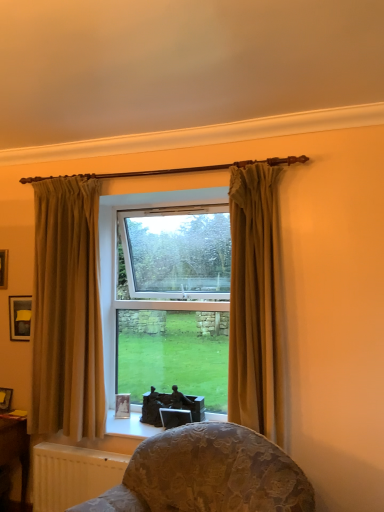
What do you see at coordinates (15, 448) in the screenshot?
I see `wooden table at lower left` at bounding box center [15, 448].

Identify the location of matte silver picture frame at lower center, which is counted as the 4th picture frame, starting from the left. The height and width of the screenshot is (512, 384). (122, 406).

How much space does matte black picture frame at upper left, placed as the third picture frame when sorted from bottom to top, occupy horizontally?

It is 1.46 inches.

Where is `matte beige curtain at left, placed as the 2th curtain when sorted from front to back`? This screenshot has width=384, height=512. matte beige curtain at left, placed as the 2th curtain when sorted from front to back is located at coordinates (67, 311).

You are a GUI agent. You are given a task and a screenshot of the screen. Output one action in this format:
    pyautogui.click(x=<x>, y=<y>)
    Task: Click on the matte glass window at center
    
    Given the screenshot: What is the action you would take?
    pyautogui.click(x=174, y=302)

Which of these two, velvet-patterned armchair at lower center or matte black picture frame at upper left, the third picture frame in the left-to-right sequence, stands taller?

Standing taller between the two is velvet-patterned armchair at lower center.

From a real-world perspective, is velvet-patterned armchair at lower center on top of matte black picture frame at upper left, the third picture frame in the left-to-right sequence?

No, from a real-world perspective, velvet-patterned armchair at lower center is not over matte black picture frame at upper left, the third picture frame in the left-to-right sequence

Is velvet-patterned armchair at lower center positioned behind matte black picture frame at upper left, the third picture frame in the left-to-right sequence?

That is False.

Based on the photo, considering the positions of objects velvet-patterned armchair at lower center and matte black picture frame at upper left, the 2th picture frame when ordered from top to bottom, in the image provided, who is more to the right, velvet-patterned armchair at lower center or matte black picture frame at upper left, the 2th picture frame when ordered from top to bottom,?

velvet-patterned armchair at lower center.

Based on the photo, can you confirm if matte gold curtain at center, which is the 1th curtain in front-to-back order, is taller than velvet-patterned armchair at lower center?

Correct, matte gold curtain at center, which is the 1th curtain in front-to-back order, is much taller as velvet-patterned armchair at lower center.

Can you see matte gold curtain at center, which is the 1th curtain in front-to-back order, touching velvet-patterned armchair at lower center?

There is a gap between matte gold curtain at center, which is the 1th curtain in front-to-back order, and velvet-patterned armchair at lower center.

Which object is thinner, matte gold curtain at center, which is the 1th curtain in front-to-back order, or velvet-patterned armchair at lower center?

Thinner between the two is matte gold curtain at center, which is the 1th curtain in front-to-back order.

What's the angular difference between matte gold curtain at center, which is the 1th curtain from right to left, and velvet-patterned armchair at lower center's facing directions?

The angular difference between matte gold curtain at center, which is the 1th curtain from right to left, and velvet-patterned armchair at lower center is 23.5 degrees.

Considering the sizes of objects velvet-patterned armchair at lower center and matte gold curtain at center, which is the 1th curtain from right to left, in the image provided, who is smaller, velvet-patterned armchair at lower center or matte gold curtain at center, which is the 1th curtain from right to left,?

Smaller between the two is matte gold curtain at center, which is the 1th curtain from right to left.

Considering their positions, is velvet-patterned armchair at lower center located in front of or behind matte gold curtain at center, which ranks as the 2th curtain in back-to-front order?

Visually, velvet-patterned armchair at lower center is located in front of matte gold curtain at center, which ranks as the 2th curtain in back-to-front order.

From a real-world perspective, is velvet-patterned armchair at lower center below matte gold curtain at center, which ranks as the 2th curtain in back-to-front order?

Yes, from a real-world perspective, velvet-patterned armchair at lower center is under matte gold curtain at center, which ranks as the 2th curtain in back-to-front order.

In terms of width, does velvet-patterned armchair at lower center look wider or thinner when compared to matte gold curtain at center, which is the 1th curtain from right to left?

Clearly, velvet-patterned armchair at lower center has more width compared to matte gold curtain at center, which is the 1th curtain from right to left.

From a real-world perspective, which object stands above the other?

In real-world perspective, matte beige curtain at left, placed as the 2th curtain when sorted from front to back, is above.

Consider the image. Considering the positions of objects matte black picture frame at lower left, which is the 3th picture frame in right-to-left order, and matte beige curtain at left, positioned as the 1th curtain in back-to-front order, in the image provided, who is more to the left, matte black picture frame at lower left, which is the 3th picture frame in right-to-left order, or matte beige curtain at left, positioned as the 1th curtain in back-to-front order,?

matte black picture frame at lower left, which is the 3th picture frame in right-to-left order.

From the image's perspective, relative to matte beige curtain at left, which is counted as the second curtain, starting from the right, is matte black picture frame at lower left, which is the 3th picture frame in right-to-left order, above or below?

Based on their image positions, matte black picture frame at lower left, which is the 3th picture frame in right-to-left order, is located beneath matte beige curtain at left, which is counted as the second curtain, starting from the right.

Is there a large distance between matte black picture frame at lower left, which ranks as the second picture frame in bottom-to-top order, and matte beige curtain at left, positioned as the 1th curtain in back-to-front order?

matte black picture frame at lower left, which ranks as the second picture frame in bottom-to-top order, is near matte beige curtain at left, positioned as the 1th curtain in back-to-front order, not far away.

Does wooden table at lower left have a larger size compared to velvet-patterned armchair at lower center?

No.

In the scene shown: Considering the relative sizes of wooden table at lower left and velvet-patterned armchair at lower center in the image provided, is wooden table at lower left taller than velvet-patterned armchair at lower center?

Yes, wooden table at lower left is taller than velvet-patterned armchair at lower center.

Is velvet-patterned armchair at lower center at the back of wooden table at lower left?

No, wooden table at lower left is not facing the opposite direction of velvet-patterned armchair at lower center.

Is wooden table at lower left touching velvet-patterned armchair at lower center?

wooden table at lower left is not next to velvet-patterned armchair at lower center, and they're not touching.

How distant is wooden table at lower left from matte gold curtain at center, which is the 1th curtain in front-to-back order?

wooden table at lower left and matte gold curtain at center, which is the 1th curtain in front-to-back order, are 1.71 meters apart from each other.

Consider the image. Is wooden table at lower left not within matte gold curtain at center, which is the 1th curtain in front-to-back order?

wooden table at lower left lies outside matte gold curtain at center, which is the 1th curtain in front-to-back order,'s area.

From the image's perspective, which one is positioned higher, wooden table at lower left or matte gold curtain at center, which is the 1th curtain in front-to-back order?

matte gold curtain at center, which is the 1th curtain in front-to-back order.

Considering the sizes of objects wooden table at lower left and matte gold curtain at center, the 2th curtain viewed from the left, in the image provided, who is thinner, wooden table at lower left or matte gold curtain at center, the 2th curtain viewed from the left,?

matte gold curtain at center, the 2th curtain viewed from the left, is thinner.

This screenshot has height=512, width=384. Identify the location of bay window below the matte gold curtain at center, the 2th curtain viewed from the left (from the image's perspective). (174, 302).

Does matte glass window at center turn towards matte gold curtain at center, which is the 1th curtain from right to left?

No, matte glass window at center does not turn towards matte gold curtain at center, which is the 1th curtain from right to left.

Who is more distant, matte glass window at center or matte gold curtain at center, which is the 1th curtain in front-to-back order?

matte glass window at center is more distant.

Find the location of a particular element. The width and height of the screenshot is (384, 512). furniture that appears below the matte black picture frame at upper left, placed as the third picture frame when sorted from bottom to top (from the image's perspective) is located at coordinates (208, 474).

Where is `furniture in front of the matte gold curtain at center, the 2th curtain viewed from the left`? The image size is (384, 512). furniture in front of the matte gold curtain at center, the 2th curtain viewed from the left is located at coordinates (208, 474).

Which object lies further to the anchor point matte gold curtain at center, which ranks as the 2th curtain in back-to-front order, matte black picture frame at upper left, the 2th picture frame when ordered from top to bottom, or matte black picture frame at upper left, placed as the first picture frame when sorted from left to right?

matte black picture frame at upper left, placed as the first picture frame when sorted from left to right, is positioned further to the anchor matte gold curtain at center, which ranks as the 2th curtain in back-to-front order.

Estimate the real-world distances between objects in this image. Which object is further from matte silver picture frame at lower center, the fourth picture frame positioned from the top, matte black picture frame at upper left, which is the 2th picture frame from right to left, or matte black picture frame at lower left, the third picture frame in the top-to-bottom sequence?

Based on the image, matte black picture frame at upper left, which is the 2th picture frame from right to left, appears to be further to matte silver picture frame at lower center, the fourth picture frame positioned from the top.

Considering their positions, is matte black picture frame at lower left, the 2th picture frame from the left, positioned closer to matte silver picture frame at lower center, the fourth picture frame positioned from the top, than matte beige curtain at left, positioned as the 1th curtain in back-to-front order?

Among the two, matte black picture frame at lower left, the 2th picture frame from the left, is located nearer to matte silver picture frame at lower center, the fourth picture frame positioned from the top.

Which object lies further to the anchor point white textured radiator at lower left, matte black picture frame at upper left, which is the fourth picture frame from right to left, or matte gold curtain at center, which is the 1th curtain from right to left?

The object further to white textured radiator at lower left is matte black picture frame at upper left, which is the fourth picture frame from right to left.

Estimate the real-world distances between objects in this image. Which object is closer to matte silver picture frame at lower center, which is counted as the 4th picture frame, starting from the left, matte black picture frame at lower left, which is the 3th picture frame in right-to-left order, or matte black picture frame at upper left, marked as the fourth picture frame in a bottom-to-top arrangement?

matte black picture frame at lower left, which is the 3th picture frame in right-to-left order, is positioned closer to the anchor matte silver picture frame at lower center, which is counted as the 4th picture frame, starting from the left.

Based on their spatial positions, is velvet-patterned armchair at lower center or matte gold curtain at center, which is the 1th curtain in front-to-back order, closer to matte beige curtain at left, which is counted as the second curtain, starting from the right?

Among the two, velvet-patterned armchair at lower center is located nearer to matte beige curtain at left, which is counted as the second curtain, starting from the right.

Considering their positions, is matte beige curtain at left, placed as the 1th curtain when sorted from left to right, positioned closer to matte silver picture frame at lower center, which is counted as the first picture frame, starting from the right, than velvet-patterned armchair at lower center?

Based on the image, matte beige curtain at left, placed as the 1th curtain when sorted from left to right, appears to be nearer to matte silver picture frame at lower center, which is counted as the first picture frame, starting from the right.

Considering their positions, is velvet-patterned armchair at lower center positioned further to matte black picture frame at upper left, the 2th picture frame when ordered from top to bottom, than matte black picture frame at lower left, which ranks as the second picture frame in bottom-to-top order?

velvet-patterned armchair at lower center lies further to matte black picture frame at upper left, the 2th picture frame when ordered from top to bottom, than the other object.

Locate an element on the screen. table between velvet-patterned armchair at lower center and matte black picture frame at upper left, placed as the first picture frame when sorted from left to right, in the front-back direction is located at coordinates (15, 448).

The image size is (384, 512). I want to click on radiator located between matte black picture frame at lower left, the third picture frame in the top-to-bottom sequence, and matte glass window at center in the left-right direction, so click(x=72, y=475).

Where is `radiator between matte black picture frame at lower left, which is the 3th picture frame in right-to-left order, and matte gold curtain at center, which ranks as the 2th curtain in back-to-front order, from left to right`? This screenshot has height=512, width=384. radiator between matte black picture frame at lower left, which is the 3th picture frame in right-to-left order, and matte gold curtain at center, which ranks as the 2th curtain in back-to-front order, from left to right is located at coordinates (72, 475).

The image size is (384, 512). I want to click on curtain between matte black picture frame at lower left, which is the 3th picture frame in right-to-left order, and matte glass window at center, so click(x=67, y=311).